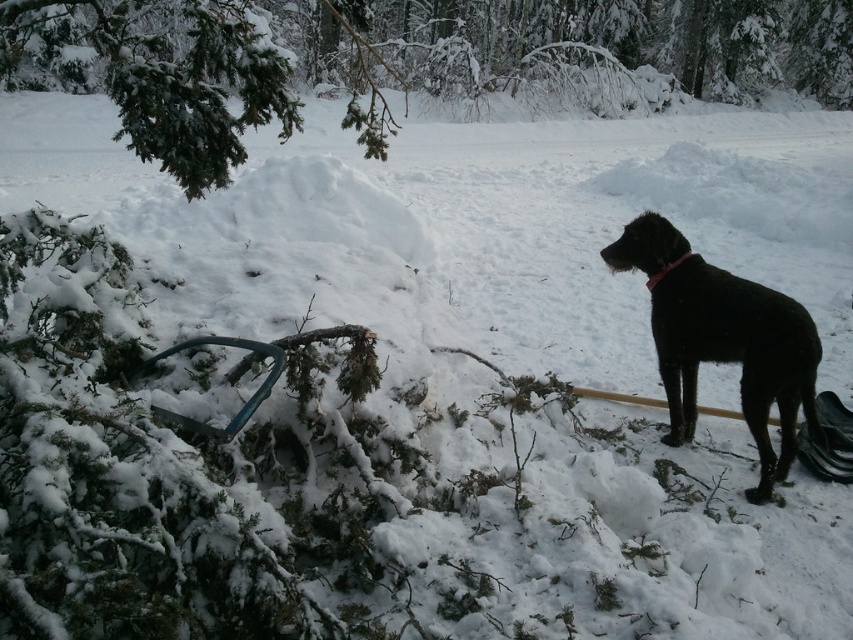
In the scene shown: Between green textured pine at upper left and black matte dog at right, which one is positioned higher?

green textured pine at upper left is above.

Does green textured pine at upper left appear on the left side of black matte dog at right?

In fact, green textured pine at upper left is to the right of black matte dog at right.

This screenshot has height=640, width=853. Identify the location of green textured pine at upper left. (407, 58).

This screenshot has width=853, height=640. In order to click on green textured pine at upper left in this screenshot , I will do `click(407, 58)`.